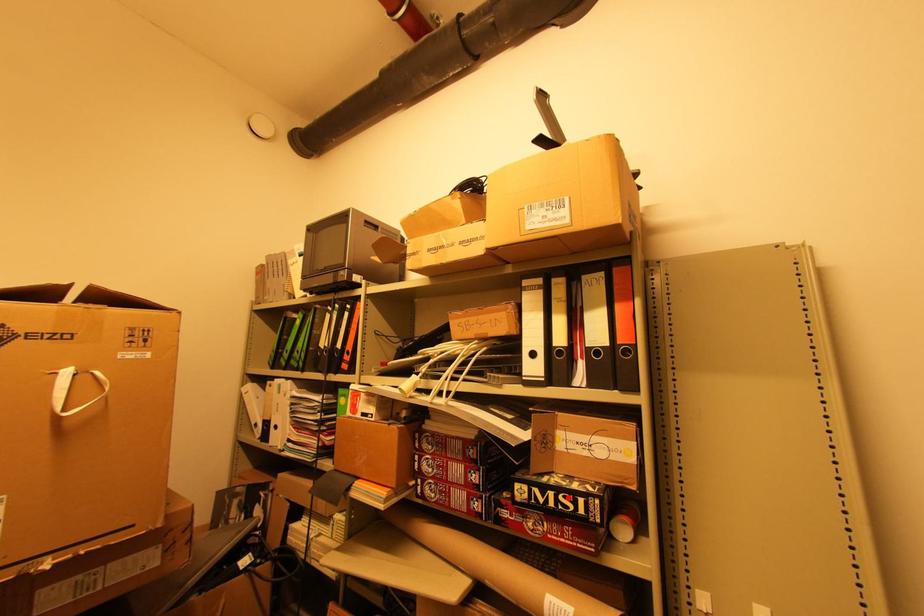
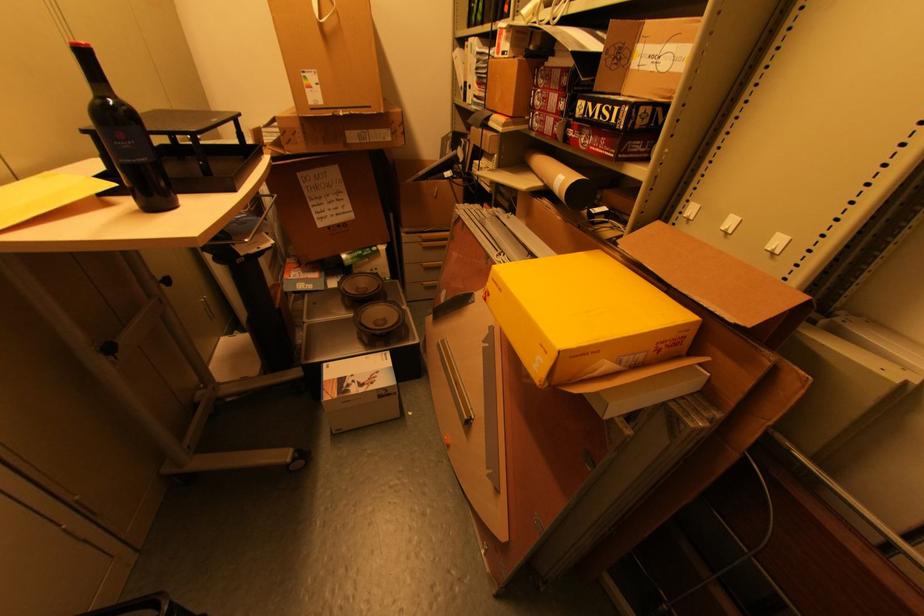
Question: I am providing you with two images of the same scene from different viewpoints. A red point is marked on the first image. Can you still see the location of the red point in image 2?

Choices:
 (A) Yes
 (B) No

Answer: (A)